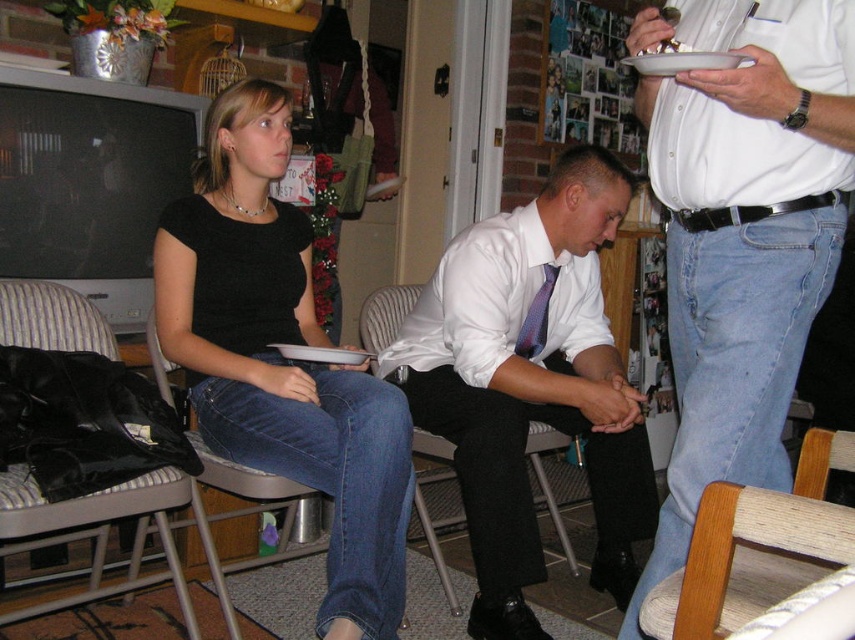
Question: Does white shirt at upper right have a greater width compared to black fabric chair at center?

Choices:
 (A) no
 (B) yes

Answer: (A)

Question: Which point is closer to the camera?

Choices:
 (A) (621, 205)
 (B) (716, 451)
 (C) (746, 602)

Answer: (C)

Question: Where is matte black shirt at center located in relation to black fabric chair at center in the image?

Choices:
 (A) below
 (B) above

Answer: (B)

Question: Which object appears farthest from the camera in this image?

Choices:
 (A) white shirt at upper right
 (B) matte black shirt at center

Answer: (B)

Question: Which point appears farthest from the camera in this image?

Choices:
 (A) (345, 520)
 (B) (22, 332)
 (C) (444, 262)
 (D) (765, 188)

Answer: (C)

Question: Does white shirt at upper right appear on the right side of white satin shirt at center?

Choices:
 (A) no
 (B) yes

Answer: (B)